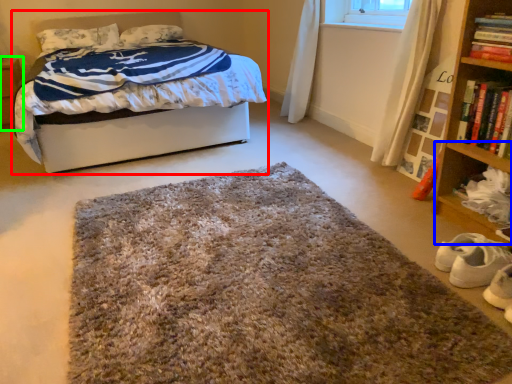
Question: Which object is positioned closest to bed (highlighted by a red box)? Select from shelf (highlighted by a blue box) and nightstand (highlighted by a green box).

Choices:
 (A) shelf
 (B) nightstand

Answer: (B)